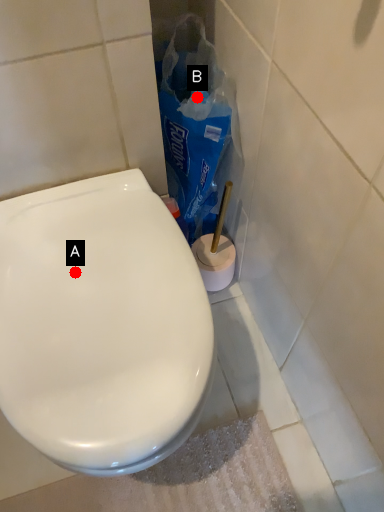
Question: Two points are circled on the image, labeled by A and B beside each circle. Which point is closer to the camera?

Choices:
 (A) A is closer
 (B) B is closer

Answer: (A)